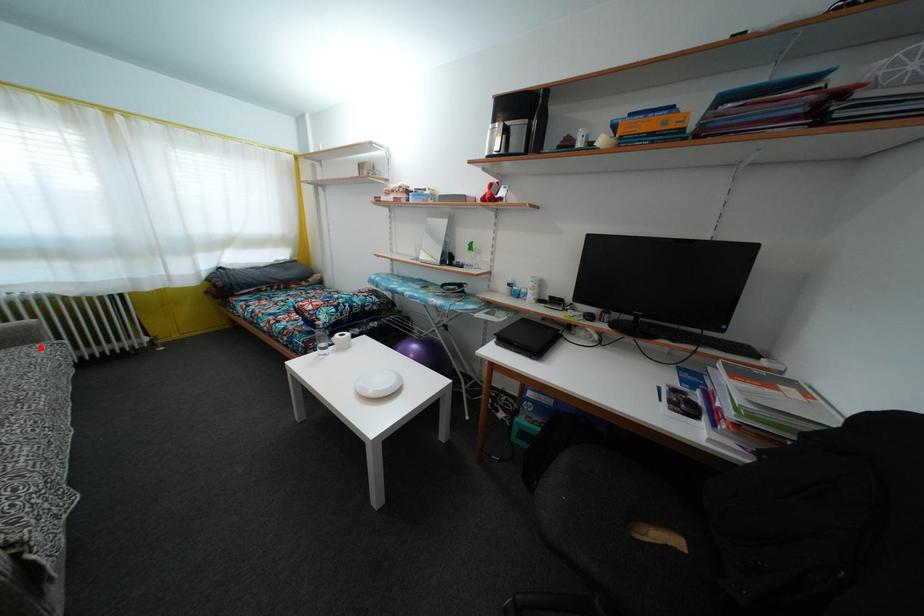
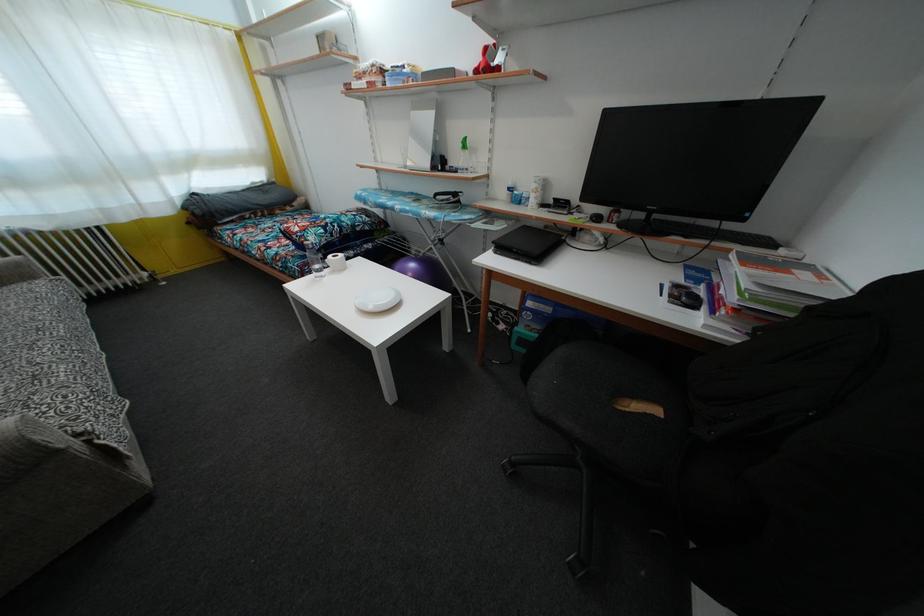
Find the pixel in the second image that matches the highlighted location in the first image.

(38, 284)